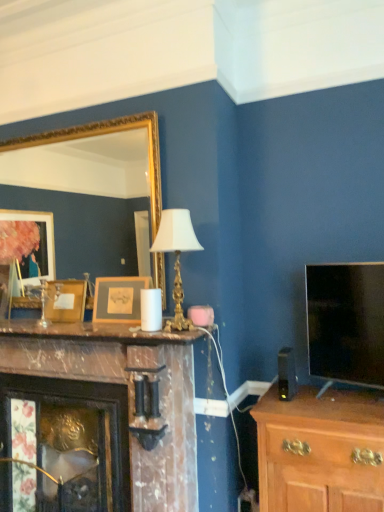
Question: From a real-world perspective, is marble mantel at center under wooden picture frame at center-left, arranged as the first picture frame when viewed from the left?

Choices:
 (A) no
 (B) yes

Answer: (B)

Question: Is marble mantel at center aimed at wooden picture frame at center-left, acting as the second picture frame starting from the right?

Choices:
 (A) no
 (B) yes

Answer: (A)

Question: Is marble mantel at center oriented away from wooden picture frame at center-left, acting as the 1th picture frame starting from the back?

Choices:
 (A) no
 (B) yes

Answer: (A)

Question: Considering the relative positions of marble mantel at center and wooden picture frame at center-left, acting as the second picture frame starting from the right, in the image provided, is marble mantel at center in front of wooden picture frame at center-left, acting as the second picture frame starting from the right,?

Choices:
 (A) no
 (B) yes

Answer: (B)

Question: From the image's perspective, is marble mantel at center located above wooden picture frame at center-left, acting as the second picture frame starting from the right?

Choices:
 (A) no
 (B) yes

Answer: (A)

Question: Considering the relative positions of marble mantel at center and wooden picture frame at center-left, arranged as the first picture frame when viewed from the left, in the image provided, is marble mantel at center to the left of wooden picture frame at center-left, arranged as the first picture frame when viewed from the left, from the viewer's perspective?

Choices:
 (A) no
 (B) yes

Answer: (A)

Question: From the image's perspective, is gold metallic table lamp at center beneath gold-framed mirror at upper left?

Choices:
 (A) yes
 (B) no

Answer: (A)

Question: Can we say gold metallic table lamp at center lies outside gold-framed mirror at upper left?

Choices:
 (A) yes
 (B) no

Answer: (A)

Question: Is gold metallic table lamp at center thinner than gold-framed mirror at upper left?

Choices:
 (A) no
 (B) yes

Answer: (A)

Question: Is gold metallic table lamp at center not close to gold-framed mirror at upper left?

Choices:
 (A) yes
 (B) no

Answer: (B)

Question: Is gold metallic table lamp at center smaller than gold-framed mirror at upper left?

Choices:
 (A) yes
 (B) no

Answer: (A)

Question: From a real-world perspective, is gold metallic table lamp at center physically below gold-framed mirror at upper left?

Choices:
 (A) no
 (B) yes

Answer: (B)

Question: Can you confirm if wooden picture frame at center, acting as the first picture frame starting from the right, is positioned to the left of gold metallic table lamp at center?

Choices:
 (A) yes
 (B) no

Answer: (A)